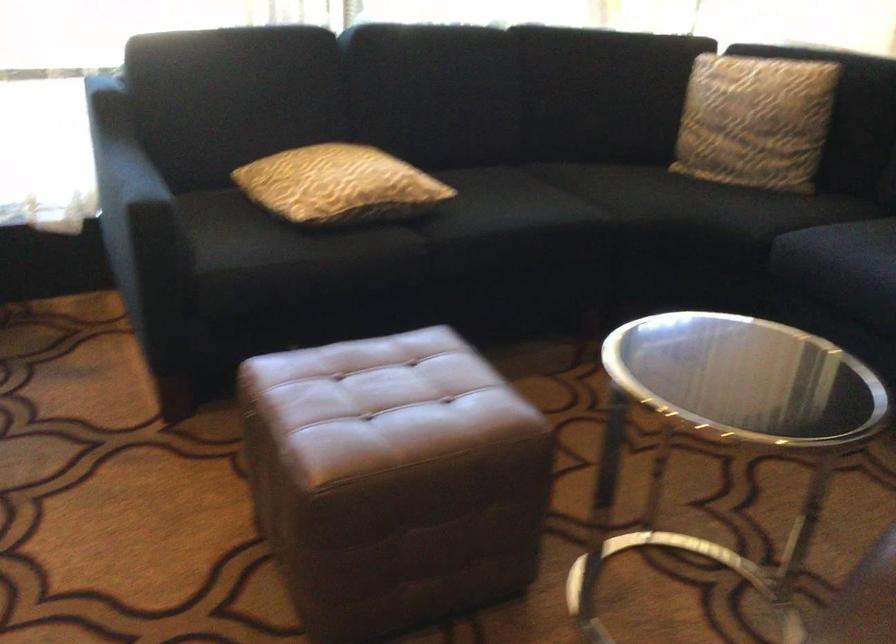
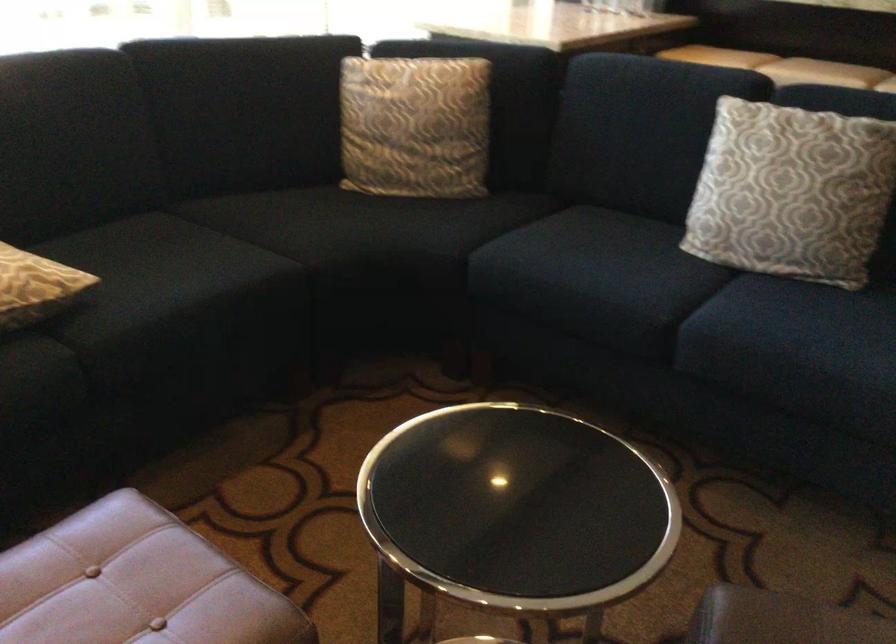
Find the pixel in the second image that matches [753,114] in the first image.

(415, 126)